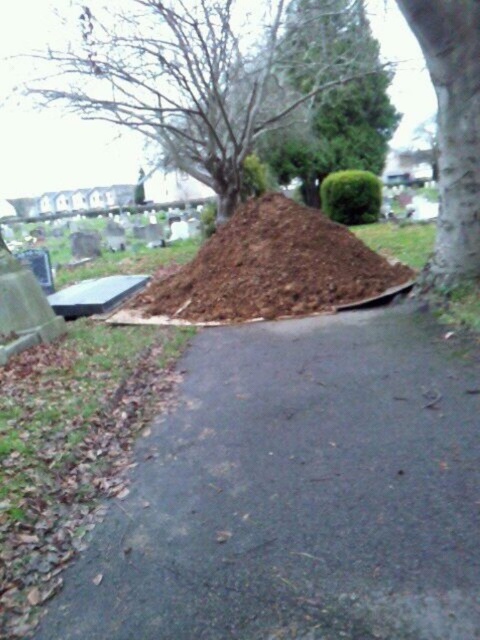
You are standing at the entrance of the cemetery and want to reach the brown soil at center. Which direction should you walk to get there?

The brown soil at center is located at coordinates 0.419 on the x axis and 0.571 on the y axis. Since you are at the entrance, you should walk towards the center of the image to reach it.

You are a gardener who wants to plant a new tree in the cemetery. You have a sapling that requires a planting area wider than the brown dirt at center. Can you use the space next to the smooth bark tree at right for planting?

The brown dirt at center is positioned on the left side of smooth bark tree at right, so the space next to the smooth bark tree at right is available. However, since the sapling requires a planting area wider than the brown dirt at center, you need to check if the space next to the tree has sufficient width. If the available space is wider than the brown dirt, then it would be suitable. Otherwise, another location should be considered.